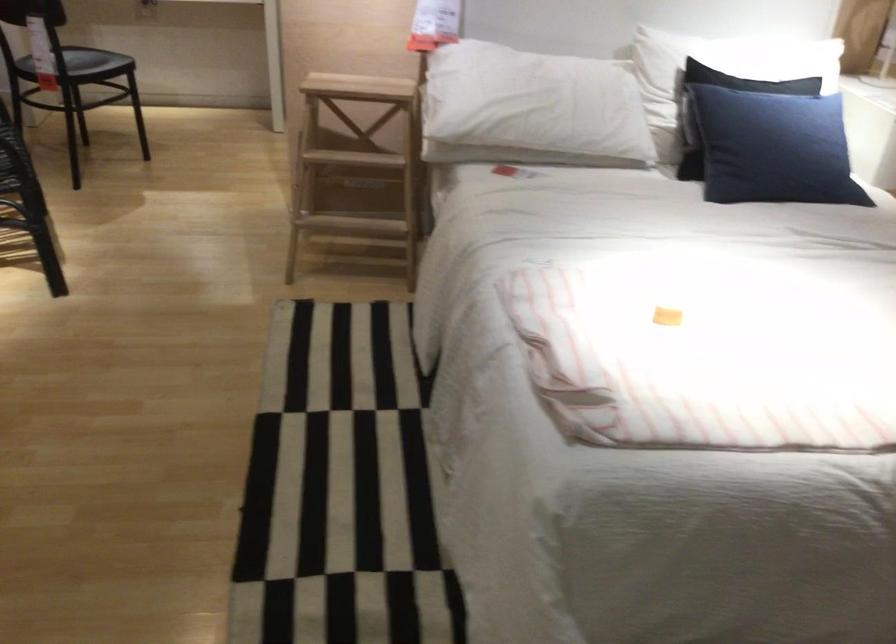
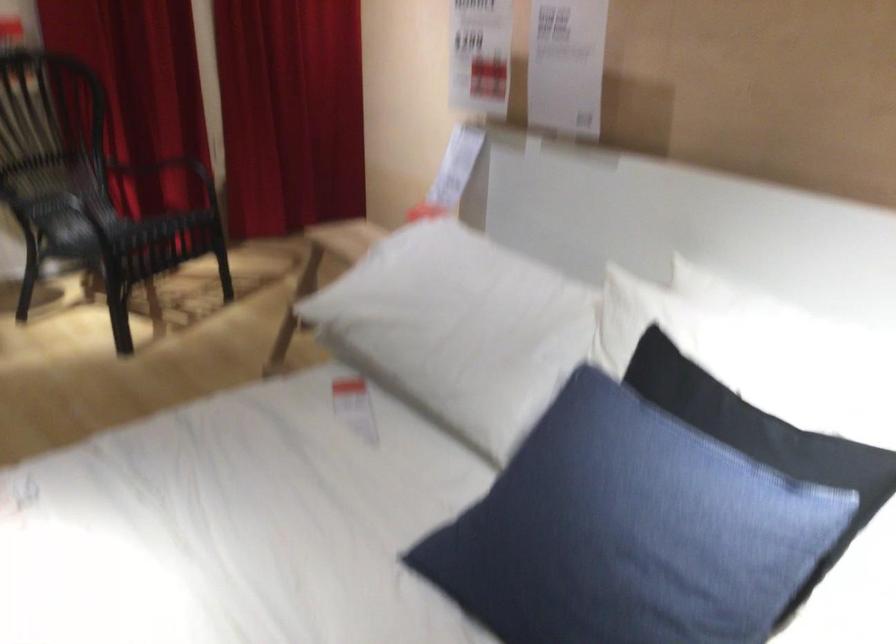
Find the pixel in the second image that matches (806,127) in the first image.

(644, 536)